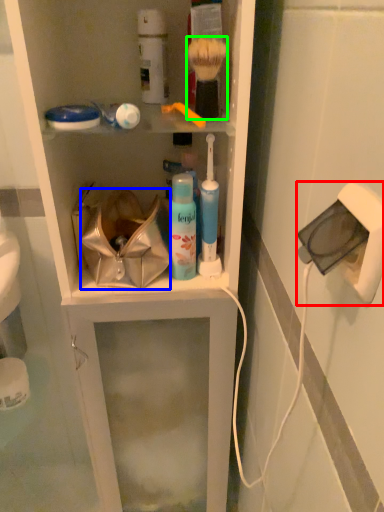
Question: Based on their relative distances, which object is farther from electric outlet (highlighted by a red box)? Choose from handbag (highlighted by a blue box) and brush (highlighted by a green box).

Choices:
 (A) handbag
 (B) brush

Answer: (A)